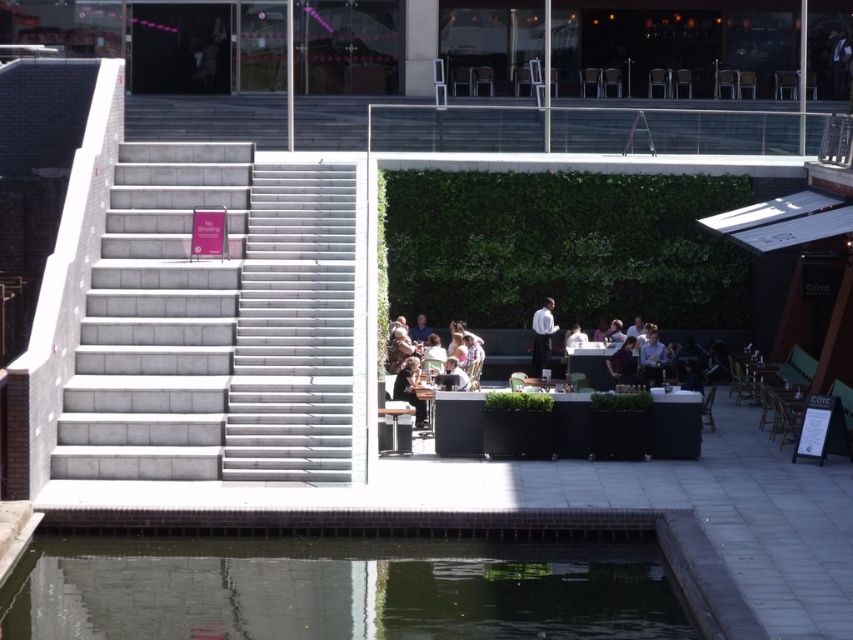
Question: Is white concrete stairs at center smaller than black leather jacket at center?

Choices:
 (A) no
 (B) yes

Answer: (B)

Question: Can you confirm if gray concrete stairs at left is positioned to the right of dark brown leather jacket at center?

Choices:
 (A) yes
 (B) no

Answer: (B)

Question: Is dark reflective water at lower center to the left of dark brown leather jacket at center from the viewer's perspective?

Choices:
 (A) no
 (B) yes

Answer: (B)

Question: Which object is positioned farthest from the white matte shirt at center?

Choices:
 (A) dark brown leather jacket at center
 (B) matte black chair at center
 (C) black leather jacket at center
 (D) dark reflective water at lower center

Answer: (D)

Question: Which point is farther to the camera?

Choices:
 (A) white concrete stairs at center
 (B) light brown leather jacket at center
 (C) matte black chair at center
 (D) white matte shirt at center

Answer: (D)

Question: Which of the following is the farthest from the observer?

Choices:
 (A) (538, 374)
 (B) (120, 444)

Answer: (A)